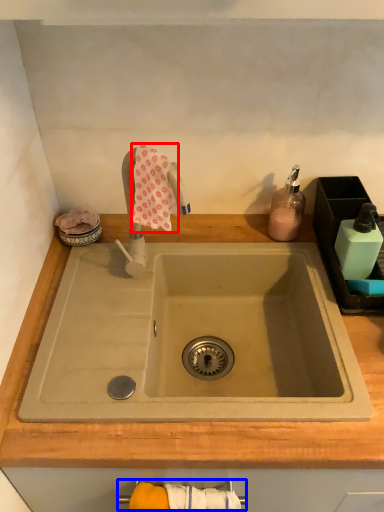
Question: Which point is further to the camera, bath towel (highlighted by a red box) or towel bar (highlighted by a blue box)?

Choices:
 (A) bath towel
 (B) towel bar

Answer: (A)